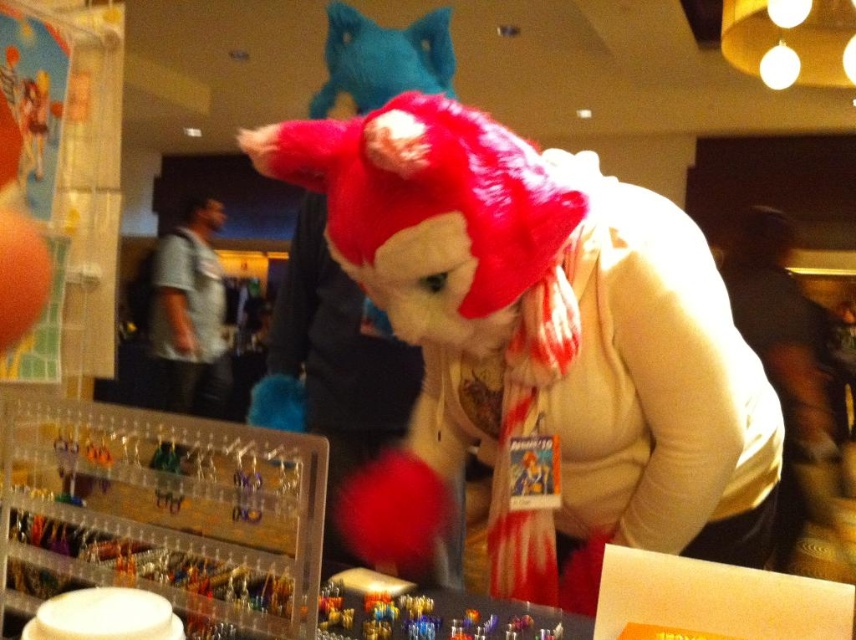
In the scene shown: You are at an event and want to know the position of the white soft scarf at center relative to the velvet teal cat at upper center. Which object is positioned to the right?

The white soft scarf at center is to the right of the velvet teal cat at upper center.

You are standing in the center of the room and want to find the white soft scarf at center. According to the coordinates provided, where should you look relative to your position?

The white soft scarf at center is located at coordinates point (786,362), which means it is positioned slightly to the right and above your current central position in the room.